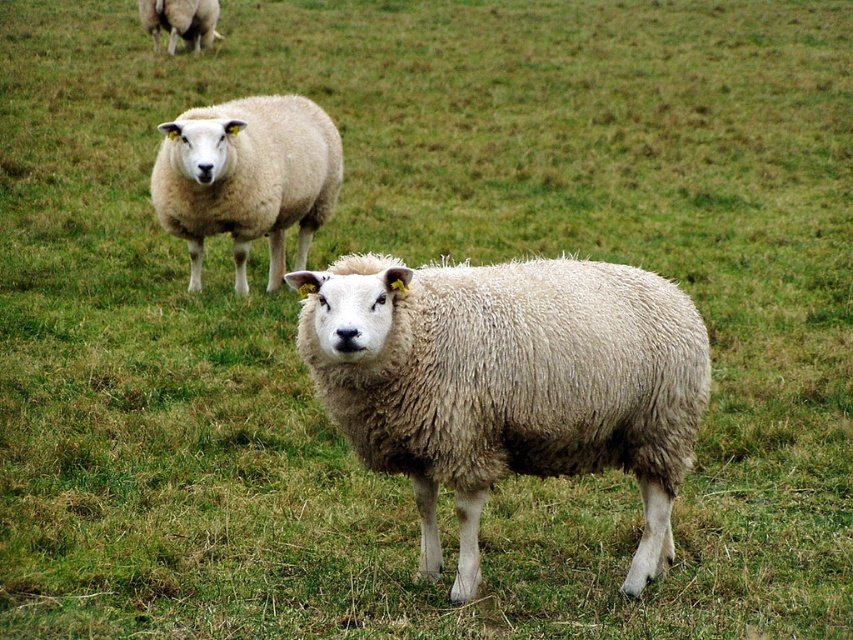
You are standing in the field and see two points marked in the image. Which point is nearer to you, point (463, 432) or point (218, 4)?

Point (463, 432) is closer to the viewer than point (218, 4).

You are a farmer checking the positioning of your sheep in the field. You have a drone that can drop a treat to attract them. If you want to drop the treat exactly where the fuzzy woolen sheep at center is standing, what are the coordinates you should input into the drone?

The fuzzy woolen sheep at center is located at point (x=508, y=381), so you should input those coordinates into the drone to drop the treat exactly where the fuzzy woolen sheep at center is standing.

You are a farmer checking the positions of two tagged points in the field. The first point is at coordinates point(195, 115) and the second at point(212, 12). Based on the image, which point is closer to the camera?

Point(195, 115) is in front of point(212, 12), so it is closer to the camera.